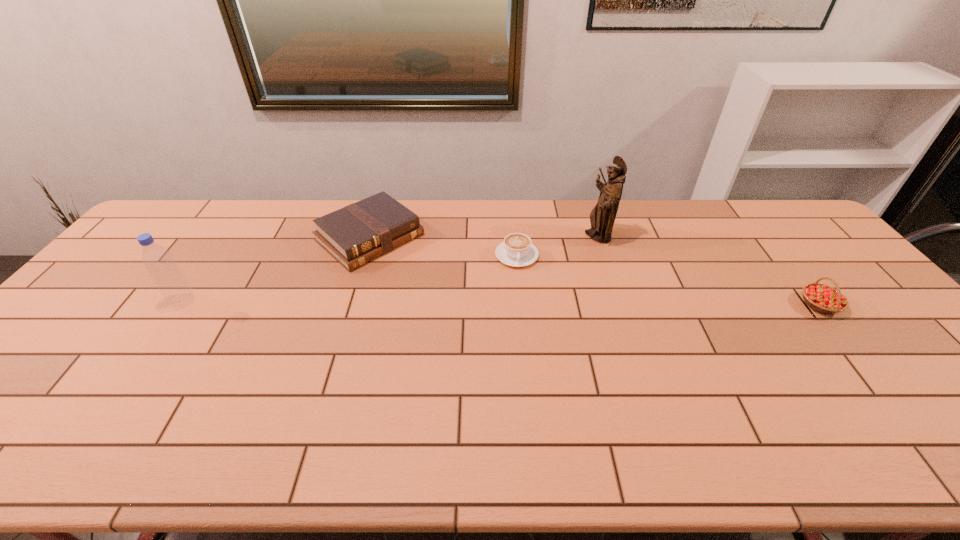
You are a GUI agent. You are given a task and a screenshot of the screen. Output one action in this format:
    pyautogui.click(x=<x>, y=<y>)
    Task: Click on the free space that is in between the cappuccino and the fourth shortest object
    
    Given the screenshot: What is the action you would take?
    pyautogui.click(x=349, y=279)

Where is `vacant area between the rightmost object and the fourth object from right to left`? vacant area between the rightmost object and the fourth object from right to left is located at coordinates (595, 271).

Where is `unoccupied area between the third object from left to right and the second tallest object`? The height and width of the screenshot is (540, 960). unoccupied area between the third object from left to right and the second tallest object is located at coordinates (349, 279).

This screenshot has width=960, height=540. In order to click on free space between the figurine and the bottle in this screenshot , I will do `click(391, 269)`.

Where is `free space between the fourth object from left to right and the fourth object from right to left`? free space between the fourth object from left to right and the fourth object from right to left is located at coordinates (484, 237).

Where is `vacant space in between the tallest object and the rightmost object`? vacant space in between the tallest object and the rightmost object is located at coordinates (708, 271).

Identify the location of vacant area between the second tallest object and the second object from left to right. The image size is (960, 540). (276, 269).

This screenshot has width=960, height=540. In order to click on unoccupied area between the second object from left to right and the strawberry in this screenshot , I will do `click(595, 271)`.

Identify the location of object that is the nearest to the shortest object. (602, 217).

What are the coordinates of `object identified as the closest to the shortest object` in the screenshot? It's located at (602, 217).